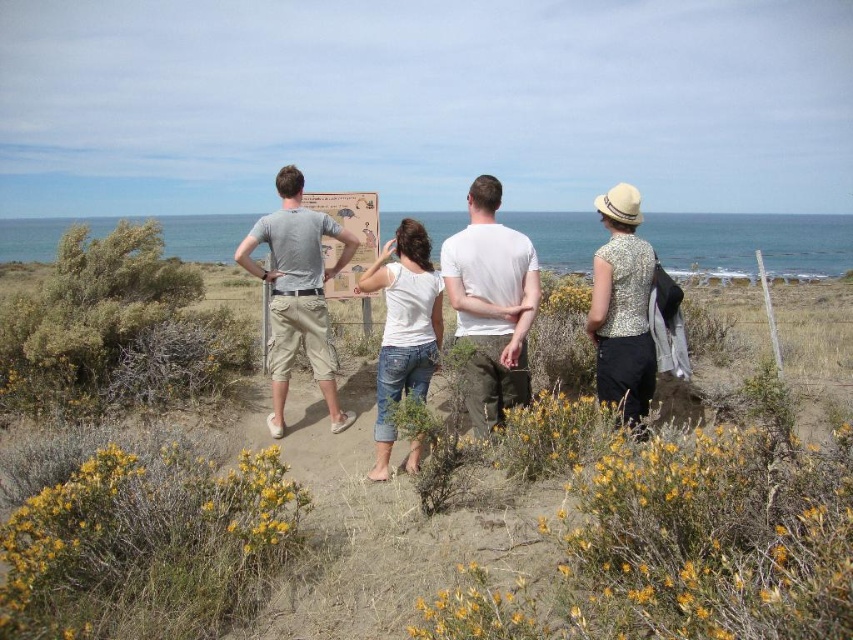
Does yellow fuzzy bush at lower center appear over white matte shirt at center?

Actually, yellow fuzzy bush at lower center is below white matte shirt at center.

Is point (776, 560) positioned in front of point (490, 426)?

That is True.

Locate an element on the screen. yellow fuzzy bush at lower center is located at coordinates (686, 545).

Between white matte shirt at center and matte gray t-shirt at center, which one appears on the left side from the viewer's perspective?

matte gray t-shirt at center is more to the left.

Is white matte shirt at center further to camera compared to matte gray t-shirt at center?

That is False.

At what (x,y) coordinates should I click in order to perform the action: click on white matte shirt at center. Please return your answer as a coordinate pair (x, y). Looking at the image, I should click on (491, 305).

Consider the image. Between yellow fuzzy bush at lower center and yellow fuzzy bush at lower left, which one is positioned lower?

yellow fuzzy bush at lower left is lower down.

Which of these two, yellow fuzzy bush at lower center or yellow fuzzy bush at lower left, stands taller?

Standing taller between the two is yellow fuzzy bush at lower center.

Is point (625, 544) in front of point (90, 474)?

Yes, it is in front of point (90, 474).

Identify the location of yellow fuzzy bush at lower center. This screenshot has height=640, width=853. (686, 545).